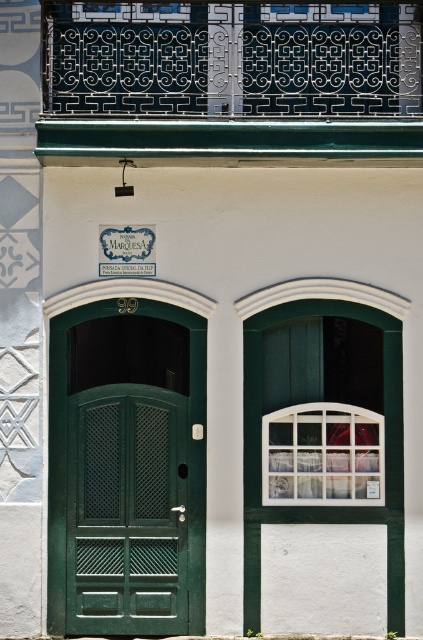
You are a delivery person trying to find the entrance to the building. You see the white glass window at center and the metallic glass window at upper center. Which window is closer to you?

The white glass window at center is closer to you because the metallic glass window at upper center is behind it.

You are standing in front of the building and want to see the sign above the entrance. Which object is located higher up between the black wrought iron at upper center and the white glass window at center?

The black wrought iron at upper center is located higher up than the white glass window at center.